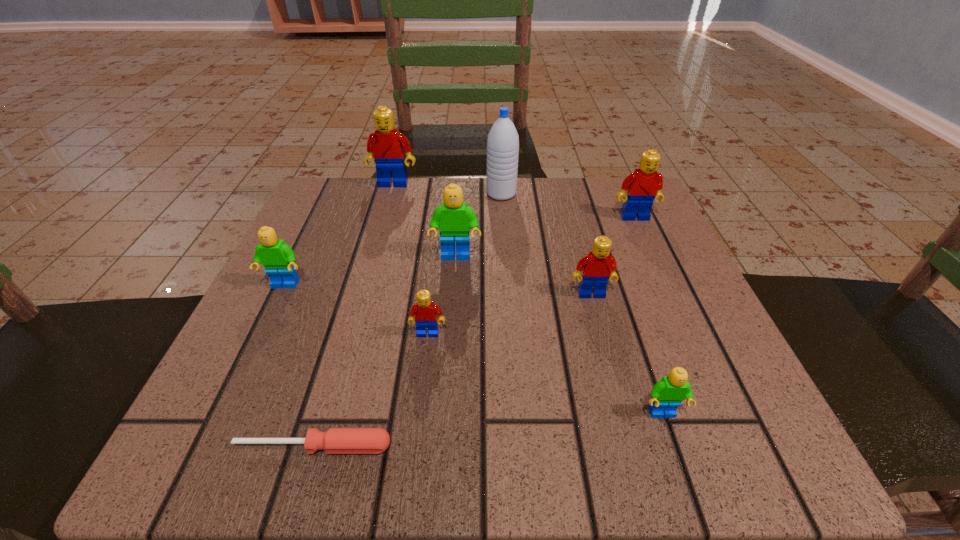
Image resolution: width=960 pixels, height=540 pixels. Find the location of `free region located 0.120m on the front-facing side of the third nearest red Lego`. free region located 0.120m on the front-facing side of the third nearest red Lego is located at coordinates (654, 259).

I want to click on vacant space situated on the face of the biggest green Lego, so click(x=448, y=379).

You are a GUI agent. You are given a task and a screenshot of the screen. Output one action in this format:
    pyautogui.click(x=<x>, y=<y>)
    Task: Click on the vacant area situated on the front-facing side of the second red Lego from right to left
    
    Given the screenshot: What is the action you would take?
    pyautogui.click(x=615, y=385)

Locate an element on the screen. Image resolution: width=960 pixels, height=540 pixels. blank space located on the face of the leftmost Lego is located at coordinates (269, 319).

Locate an element on the screen. Image resolution: width=960 pixels, height=540 pixels. vacant space located on the front-facing side of the second nearest Lego is located at coordinates (415, 450).

Where is `free location located 0.120m on the right of the shortest object`? This screenshot has width=960, height=540. free location located 0.120m on the right of the shortest object is located at coordinates (488, 446).

Find the location of a particular element. The width and height of the screenshot is (960, 540). water bottle at the far edge is located at coordinates (503, 140).

Identify the location of Lego at the near edge. This screenshot has height=540, width=960. (666, 396).

Find the location of `screwdriver that is at the near edge`. screwdriver that is at the near edge is located at coordinates (335, 440).

I want to click on screwdriver that is at the left edge, so click(x=335, y=440).